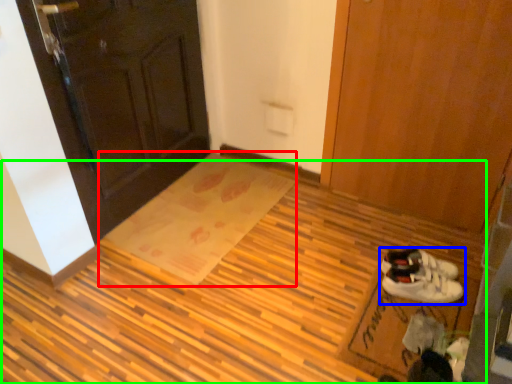
Question: Which object is positioned closest to doormat (highlighted by a red box)? Select from footwear (highlighted by a blue box) and plywood (highlighted by a green box).

Choices:
 (A) footwear
 (B) plywood

Answer: (B)